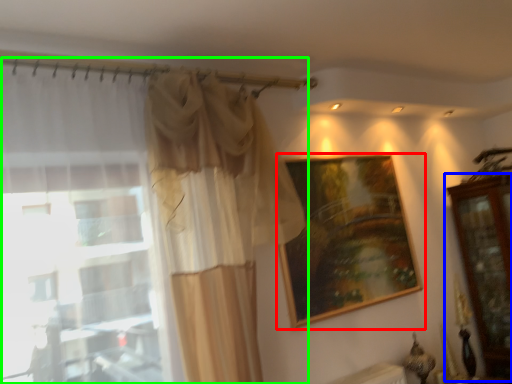
Question: Which object is positioned closest to picture frame (highlighted by a red box)? Select from dresser (highlighted by a blue box) and curtain (highlighted by a green box).

Choices:
 (A) dresser
 (B) curtain

Answer: (B)